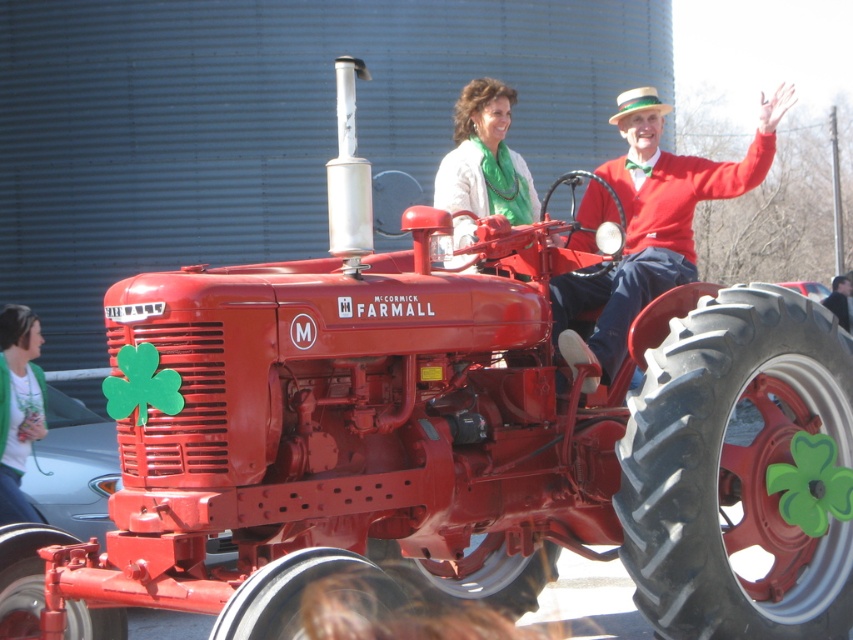
You are organizing a photo shoot and need to ensure that the red wool sweater at center and the green knitted sweater at lower left fit within a rectangular frame. Which sweater requires a wider frame to accommodate its width?

The red wool sweater at center requires a wider frame because its width is larger than the green knitted sweater at lower left.

You are organizing a clothing donation drive and need to categorize the red wool sweater at center and the green knitted sweater at lower left based on their sizes. Which sweater should be placed in the large size bin?

The red wool sweater at center should be placed in the large size bin since it has a larger size compared to the green knitted sweater at lower left.

You are a photographer at the event and need to capture a photo where both the matte green scarf at center and the green knitted sweater at lower left are in focus. The camera has a depth of field that can cover 2 meters. Will both items be in focus if you focus on the scarf?

The matte green scarf at center is 2.21 meters from the green knitted sweater at lower left. Since the distance between them exceeds the camera depth of field of 2 meters, focusing on the scarf may not keep both in focus. The sweater might appear slightly out of focus.